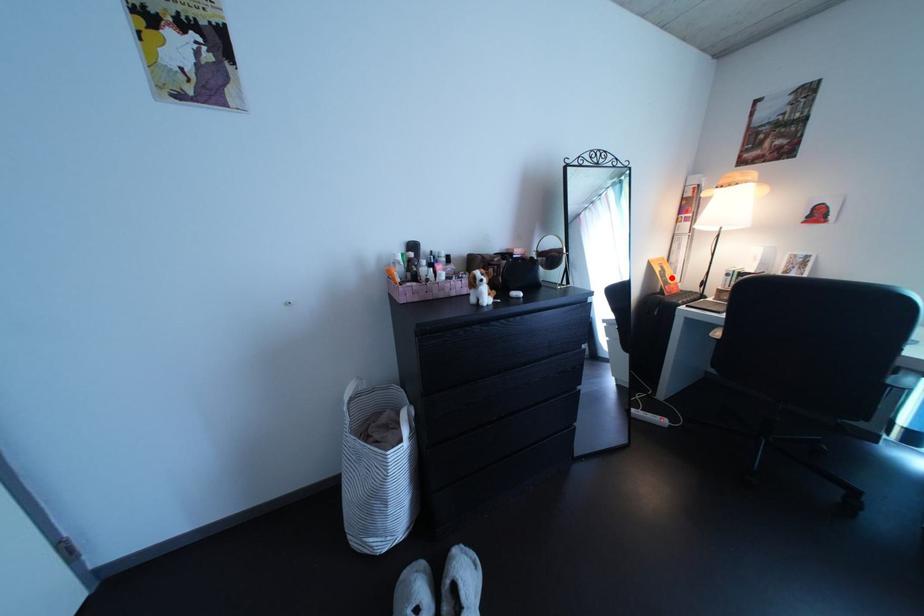
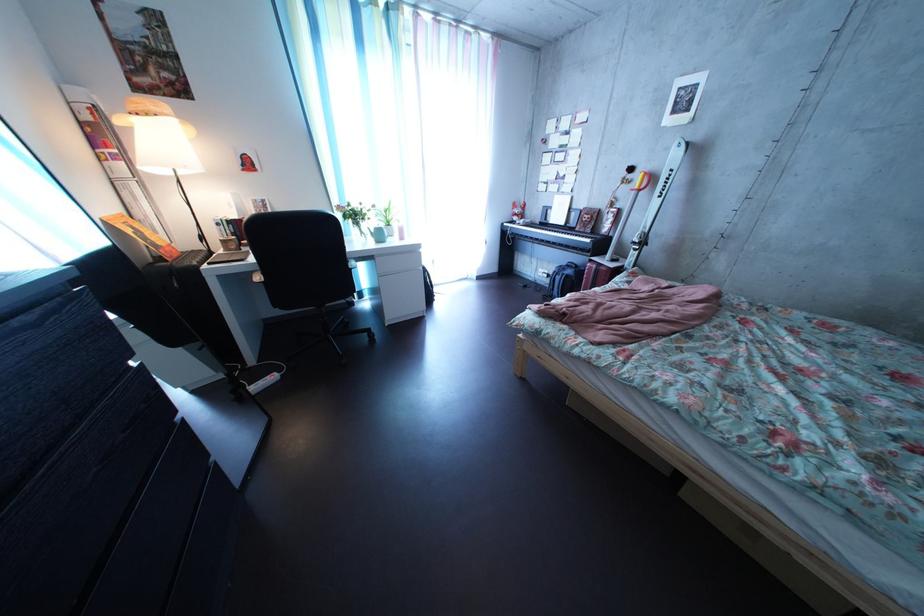
Question: I am providing you with two images of the same scene from different viewpoints. A red point is marked on the first image. Can you still see the location of the red point in image 2?

Choices:
 (A) Yes
 (B) No

Answer: (A)